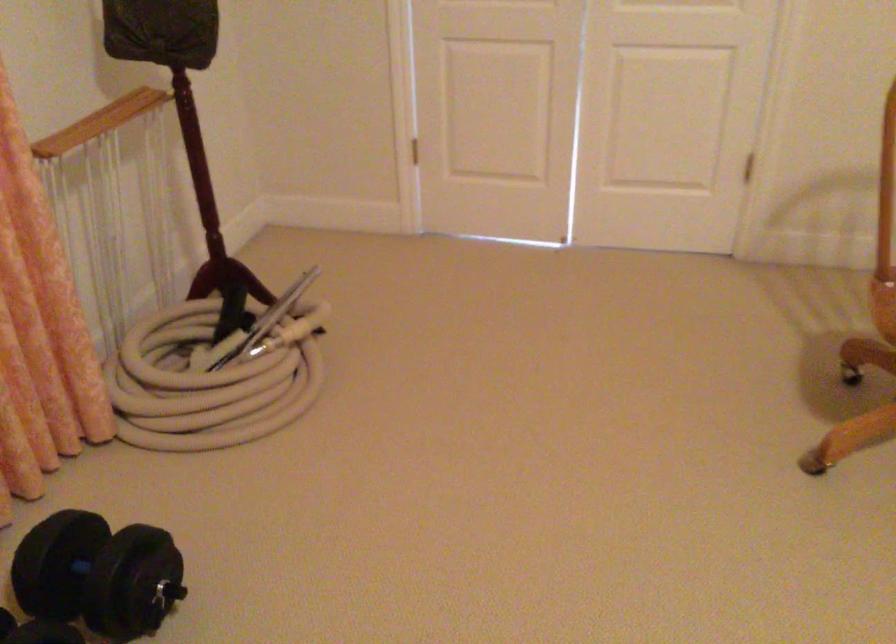
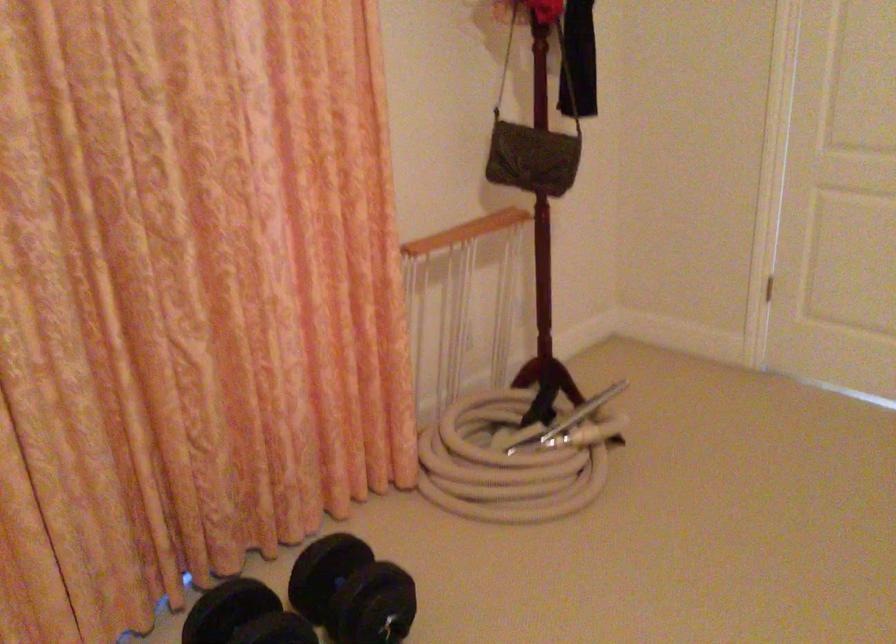
What movement of the cameraman would produce the second image?

The cameraman walked toward right, backward.